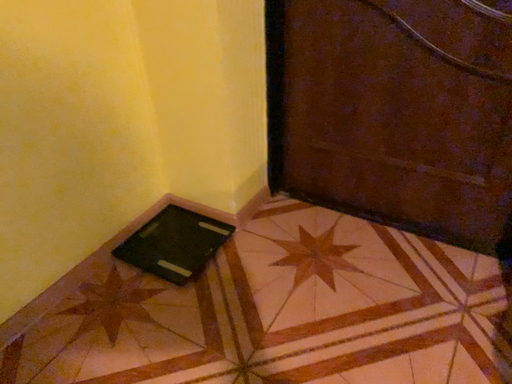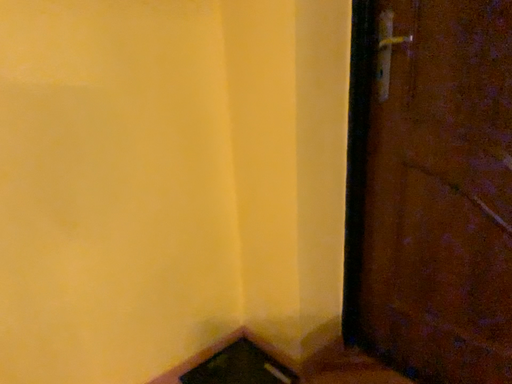
Question: How did the camera likely rotate when shooting the video?

Choices:
 (A) rotated upward
 (B) rotated downward

Answer: (A)